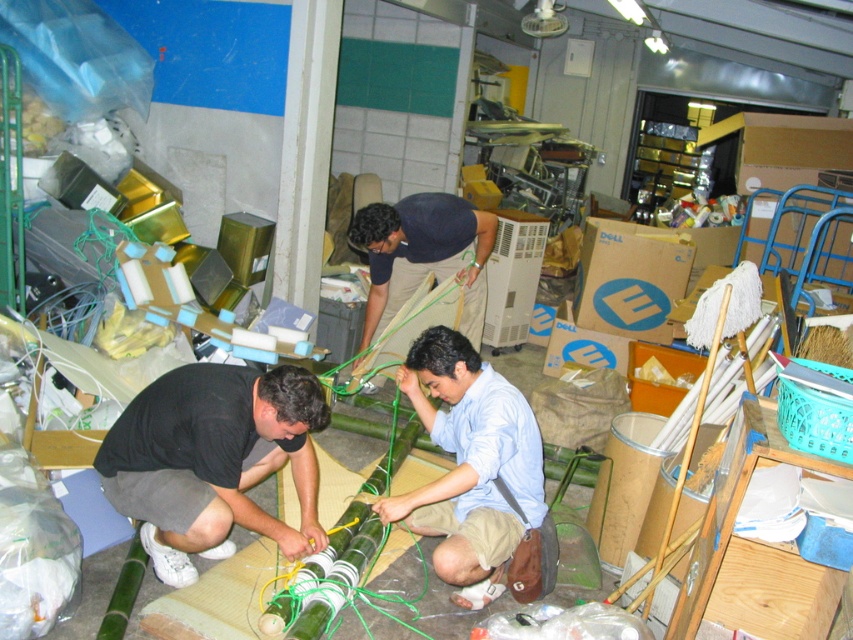
Which is behind, point (233, 401) or point (519, 451)?

Point (519, 451)

Locate an element on the screen. Image resolution: width=853 pixels, height=640 pixels. black matte shirt at lower left is located at coordinates (213, 460).

Does light blue cotton shirt at center appear on the left side of matte black shirt at center?

Incorrect, light blue cotton shirt at center is not on the left side of matte black shirt at center.

Who is more forward, (489, 378) or (438, 195)?

Point (489, 378) is more forward.

This screenshot has height=640, width=853. What do you see at coordinates (469, 465) in the screenshot?
I see `light blue cotton shirt at center` at bounding box center [469, 465].

Identify the location of light blue cotton shirt at center. This screenshot has width=853, height=640. (469, 465).

Does black matte shirt at lower left have a greater width compared to matte black shirt at center?

No.

Who is lower down, black matte shirt at lower left or matte black shirt at center?

black matte shirt at lower left is below.

Is point (224, 385) positioned after point (416, 225)?

That is False.

Locate an element on the screen. black matte shirt at lower left is located at coordinates (213, 460).